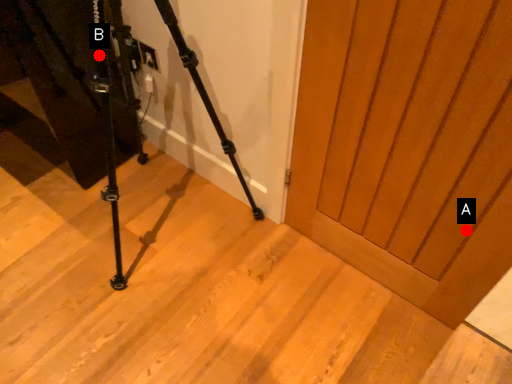
Question: Two points are circled on the image, labeled by A and B beside each circle. Which point appears closest to the camera in this image?

Choices:
 (A) A is closer
 (B) B is closer

Answer: (B)